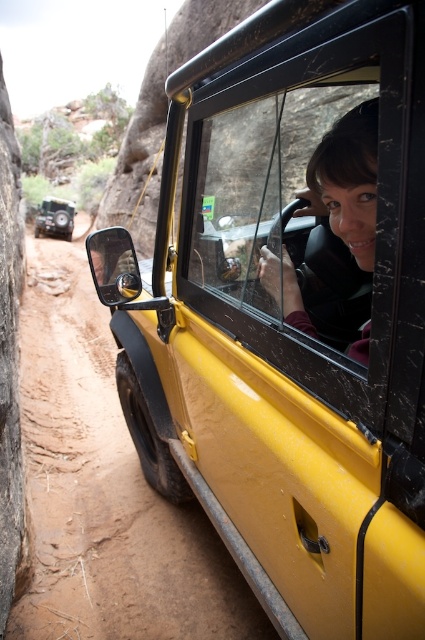
Between brown sandy dirt track at left and clear glass window at center, which one appears on the right side from the viewer's perspective?

clear glass window at center is more to the right.

At what (x,y) coordinates should I click in order to perform the action: click on brown sandy dirt track at left. Please return your answer as a coordinate pair (x, y). Looking at the image, I should click on coord(104,490).

Can you confirm if matte black hair at center is wider than matte black jeep at left?

No, matte black hair at center is not wider than matte black jeep at left.

Which is below, matte black hair at center or matte black jeep at left?

matte black hair at center

Between point (342, 198) and point (48, 227), which one is positioned in front?

Positioned in front is point (342, 198).

Identify the location of matte black hair at center. click(x=346, y=180).

In the scene shown: Who is higher up, brown sandy dirt track at left or matte black jeep at left?

matte black jeep at left is higher up.

Between point (79, 509) and point (48, 230), which one is positioned in front?

Point (79, 509)

Where is `brown sandy dirt track at left`? This screenshot has width=425, height=640. brown sandy dirt track at left is located at coordinates (104, 490).